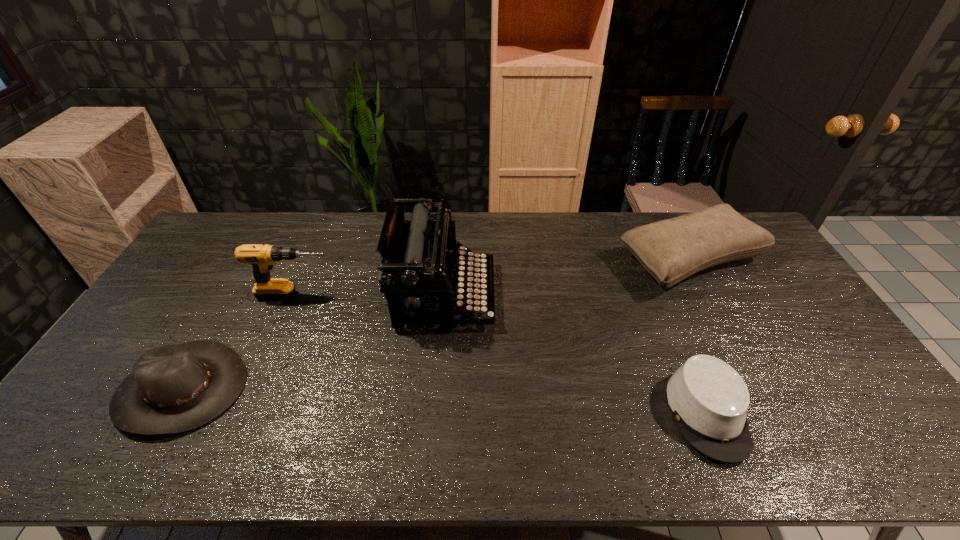
What are the coordinates of `vacant space positioned on the left of the cushion` in the screenshot? It's located at (588, 261).

At what (x,y) coordinates should I click in order to perform the action: click on vacant area situated 0.060m on the front-facing side of the fourth tallest object. Please return your answer as a coordinate pair (x, y). Looking at the image, I should click on (138, 465).

At what (x,y) coordinates should I click in order to perform the action: click on object situated at the far edge. Please return your answer as a coordinate pair (x, y). The height and width of the screenshot is (540, 960). Looking at the image, I should click on (670, 250).

Identify the location of object that is at the left edge. (172, 389).

The height and width of the screenshot is (540, 960). In order to click on object that is at the right edge in this screenshot , I will do `click(670, 250)`.

Locate an element on the screen. object at the near left corner is located at coordinates (172, 389).

Image resolution: width=960 pixels, height=540 pixels. Find the location of `object positioned at the far right corner`. object positioned at the far right corner is located at coordinates (670, 250).

Where is `vacant area at the far edge`? This screenshot has width=960, height=540. vacant area at the far edge is located at coordinates (470, 219).

In the image, there is a desktop. Identify the location of vacant space at the near edge. (623, 444).

You are a GUI agent. You are given a task and a screenshot of the screen. Output one action in this format:
    pyautogui.click(x=<x>, y=<y>)
    Task: Click on the vacant space at the left edge
    The image size is (960, 540).
    Given the screenshot: What is the action you would take?
    pyautogui.click(x=112, y=364)